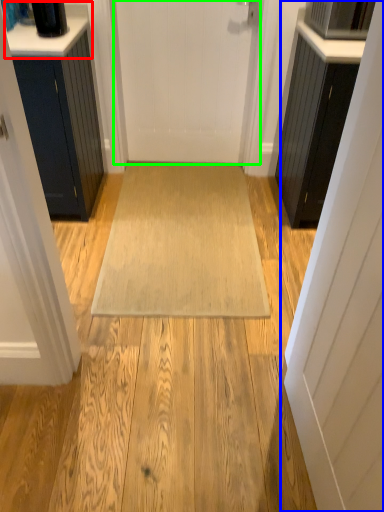
Question: Considering the real-world distances, which object is closest to counter top (highlighted by a red box)? door (highlighted by a blue box) or door (highlighted by a green box).

Choices:
 (A) door
 (B) door

Answer: (B)